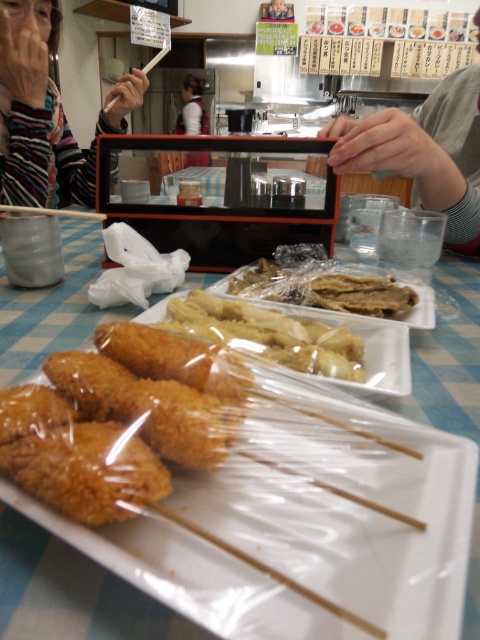
Question: Can you confirm if golden crispy skewers at center is positioned below striped fabric at upper left?

Choices:
 (A) no
 (B) yes

Answer: (B)

Question: Which object appears closest to the camera in this image?

Choices:
 (A) white plastic table at center
 (B) striped fabric at upper left
 (C) translucent plastic skewers at center

Answer: (A)

Question: Can you confirm if golden crispy chicken at center is positioned to the right of clear plastic chopstick at center?

Choices:
 (A) no
 (B) yes

Answer: (B)

Question: Does golden crispy chicken at center appear on the right side of white shirt at center?

Choices:
 (A) no
 (B) yes

Answer: (B)

Question: Which object is closer to the camera taking this photo?

Choices:
 (A) golden crispy skewers at center
 (B) white shirt at center
 (C) clear plastic chopstick at center
 (D) striped fabric at upper left

Answer: (A)

Question: Which of these objects is positioned farthest from the golden crispy skewers at center?

Choices:
 (A) striped fabric at upper left
 (B) clear plastic chopstick at center
 (C) wooden chopstick at upper center
 (D) translucent plastic skewers at center

Answer: (C)